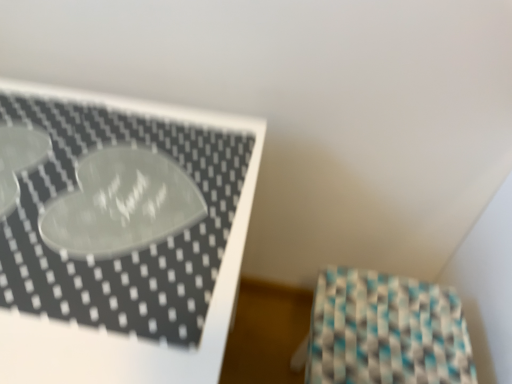
Question: Considering the positions of white glossy tray at upper left and teal-patterned fabric at lower right in the image, is white glossy tray at upper left wider or thinner than teal-patterned fabric at lower right?

Choices:
 (A) wide
 (B) thin

Answer: (A)

Question: Which is correct: white glossy tray at upper left is inside teal-patterned fabric at lower right, or outside of it?

Choices:
 (A) outside
 (B) inside

Answer: (A)

Question: In the image, is white glossy tray at upper left on the left side or the right side of teal-patterned fabric at lower right?

Choices:
 (A) right
 (B) left

Answer: (B)

Question: Is teal-patterned fabric at lower right inside the boundaries of white glossy tray at upper left, or outside?

Choices:
 (A) inside
 (B) outside

Answer: (B)

Question: In terms of size, does teal-patterned fabric at lower right appear bigger or smaller than white glossy tray at upper left?

Choices:
 (A) big
 (B) small

Answer: (B)

Question: Is teal-patterned fabric at lower right wider or thinner than white glossy tray at upper left?

Choices:
 (A) wide
 (B) thin

Answer: (B)

Question: Considering the positions of point (373, 309) and point (193, 251), is point (373, 309) closer or farther from the camera than point (193, 251)?

Choices:
 (A) farther
 (B) closer

Answer: (A)